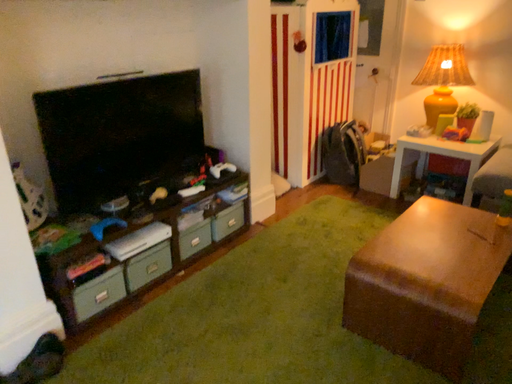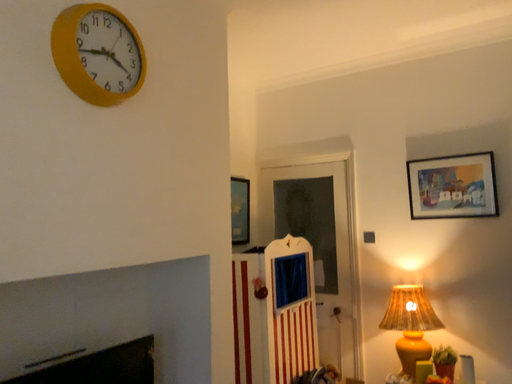
Question: Which way did the camera rotate in the video?

Choices:
 (A) rotated left
 (B) rotated right

Answer: (B)